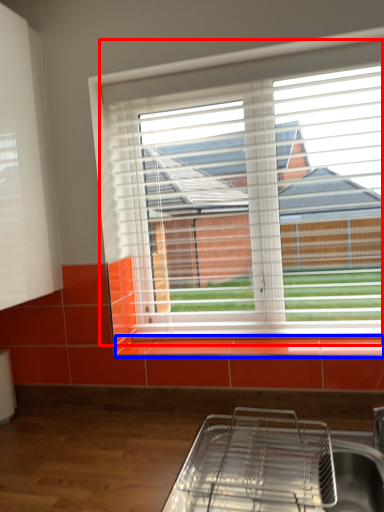
Question: Which of the following is the closest to the observer, window (highlighted by a red box) or window sill (highlighted by a blue box)?

Choices:
 (A) window
 (B) window sill

Answer: (B)